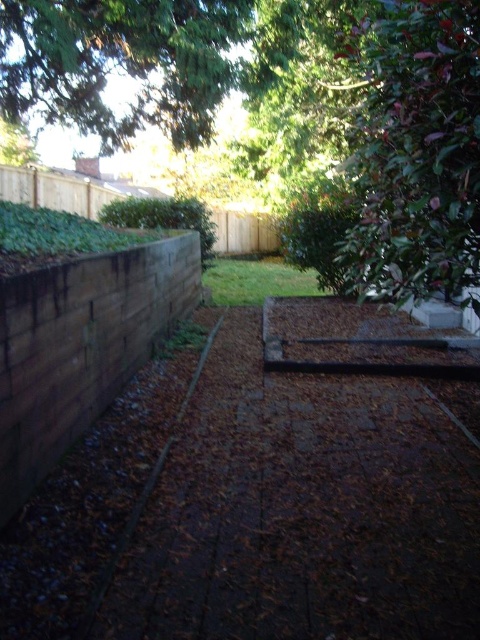
You are standing in the backyard and want to plant a new tree sapling. The green leafy tree at upper center is at point (120, 64). Where should you place the sapling so it doesn not block the view of the tree?

Place the sapling anywhere except at point (120, 64) to avoid blocking the view of the green leafy tree at upper center.

You are standing in the backyard and want to plant a new flower bed near the green leafy tree at upper right. Considering the existing raised garden bed to the right and the wooden retaining wall on the left, where would be the most suitable location for the new flower bed?

The most suitable location for the new flower bed would be near the green leafy tree at upper right, as it is positioned at coordinates point (417, 150), which is likely an open area away from the existing raised garden bed and wooden retaining wall, providing enough space for planting.

You are standing in the backyard and want to take a photo of the green leafy tree at upper right and the green leafy tree at upper center. Which tree should you focus on first if you want both trees to be in clear focus?

You should focus on the green leafy tree at upper center first because it is farther away than the green leafy tree at upper right. By focusing on the farther tree, you can ensure both are in focus using the depth of field.